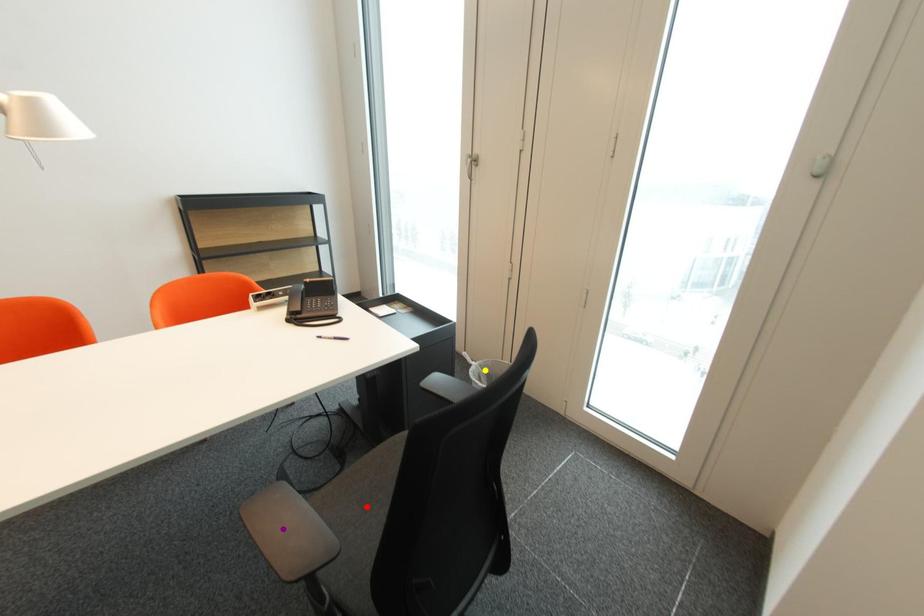
Order these from nearest to farthest:
purple point, yellow point, red point

1. yellow point
2. purple point
3. red point